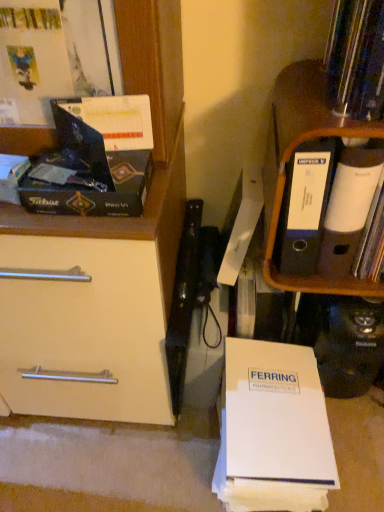
Question: From their relative heights in the image, would you say orange wood shelf at right is taller or shorter than white paper at upper right, marked as the 3th paperback book in a left-to-right arrangement?

Choices:
 (A) short
 (B) tall

Answer: (B)

Question: From the image's perspective, relative to white paper at upper right, the 1th paperback book positioned from the right, is orange wood shelf at right above or below?

Choices:
 (A) above
 (B) below

Answer: (A)

Question: Estimate the real-world distances between objects in this image. Which object is closer to the orange wood shelf at right?

Choices:
 (A) matte black box at left
 (B) matte black book at upper left, arranged as the first paperback book when viewed from the top
 (C) white paper at upper right, the 1th paperback book positioned from the right
 (D) matte black book at upper left
 (E) white paper at lower center, which ranks as the second paperback book in left-to-right order

Answer: (C)

Question: Which is nearer to the matte black box at left?

Choices:
 (A) white paper at lower center, which is counted as the third paperback book, starting from the top
 (B) white paper at upper right, marked as the 3th paperback book in a left-to-right arrangement
 (C) matte black book at upper left, arranged as the first paperback book when viewed from the top
 (D) matte black book at upper left
 (E) orange wood shelf at right

Answer: (C)